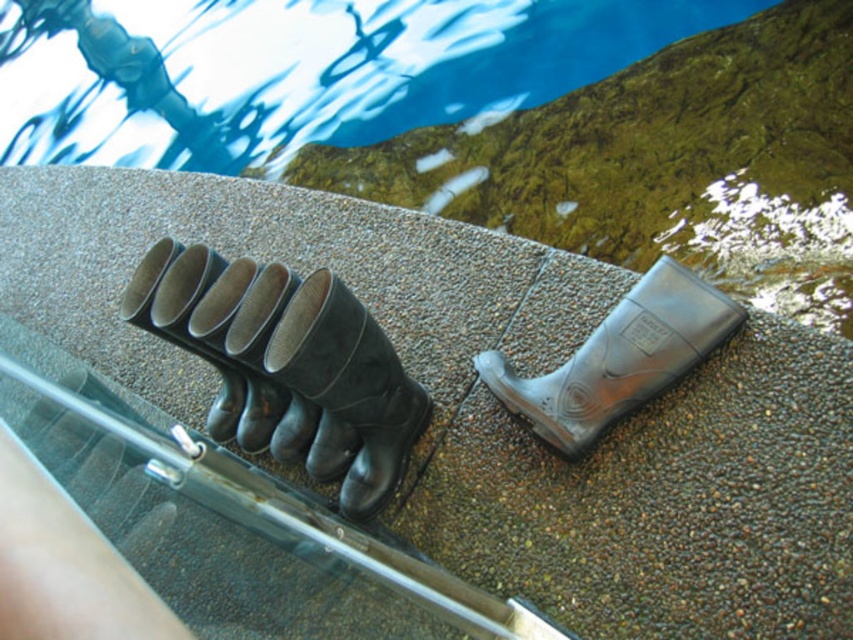
You are a lifeguard who needs to store the black rubber boots at center and the transparent rubber boot at center in a storage bin. The bin has a width of 1 meter. Can both items fit side by side without overlapping?

The black rubber boots at center might be wider than the transparent rubber boot at center. Since the bin is 1 meter wide, it depends on the combined width of both items. If their total width is less than or equal to 1 meter, they can fit side by side.

You need to choose a boot that can fit over your existing shoes for a pool cleaning task. Given the black rubber boots at center and the transparent rubber boot at center, which one is more suitable based on their sizes?

The black rubber boots at center has a larger size compared to the transparent rubber boot at center, so it is more suitable for fitting over existing shoes during pool cleaning tasks.

You are standing at the edge of the pool deck shown in the image. There is a point marked at coordinates [287,365]. What object is located at this point?

The point at coordinates [287,365] marks the location of the black rubber boots at center.